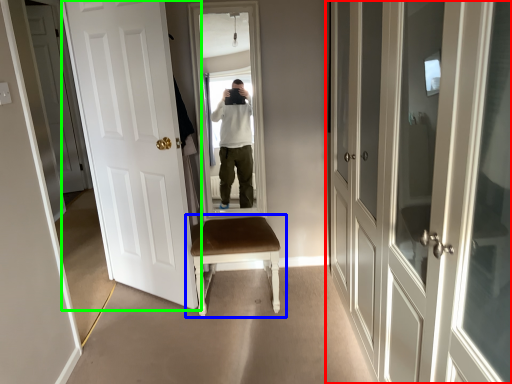
Question: Estimate the real-world distances between objects in this image. Which object is closer to door (highlighted by a red box), chair (highlighted by a blue box) or door (highlighted by a green box)?

Choices:
 (A) chair
 (B) door

Answer: (A)